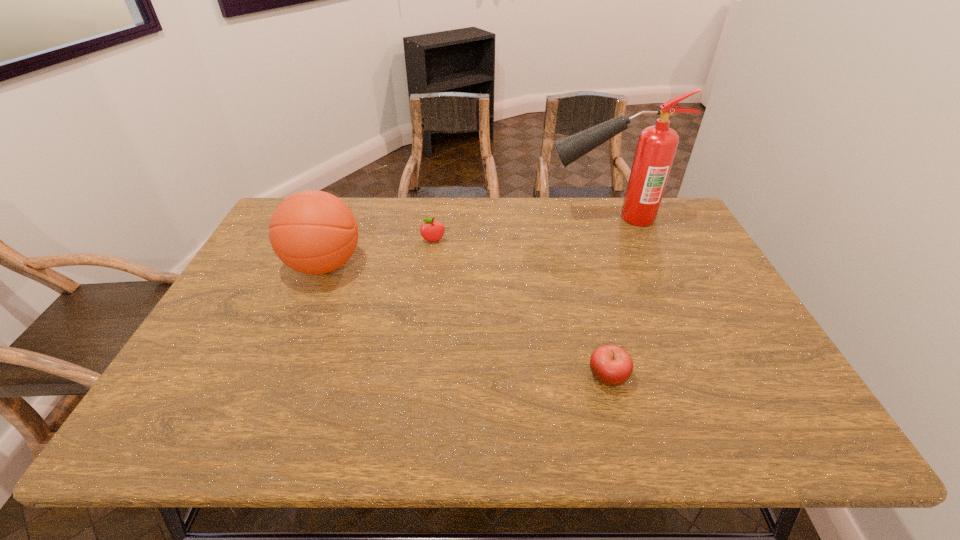
The image size is (960, 540). Identify the location of vacant region at the left edge of the desktop. (201, 402).

In the image, there is a desktop. Identify the location of vacant space at the right edge. (690, 253).

You are a GUI agent. You are given a task and a screenshot of the screen. Output one action in this format:
    pyautogui.click(x=<x>, y=<y>)
    Task: Click on the vacant space at the near left corner of the desktop
    Image resolution: width=960 pixels, height=540 pixels.
    Given the screenshot: What is the action you would take?
    pyautogui.click(x=227, y=411)

Identify the location of free area in between the second tallest object and the left apple. Image resolution: width=960 pixels, height=540 pixels. (379, 253).

Locate an element on the screen. The image size is (960, 540). free spot between the fire extinguisher and the left apple is located at coordinates (519, 230).

Find the location of a particular element. This screenshot has width=960, height=540. free space between the nearer apple and the left apple is located at coordinates (520, 309).

This screenshot has width=960, height=540. Identify the location of free space that is in between the third object from right to left and the nearer apple. (520, 309).

The image size is (960, 540). What are the coordinates of `free space between the leftmost object and the nearest object` in the screenshot? It's located at (467, 321).

What are the coordinates of `empty location between the leftmost object and the farthest object` in the screenshot? It's located at (466, 241).

Locate an element on the screen. vacant region between the farthest object and the right apple is located at coordinates (x=607, y=297).